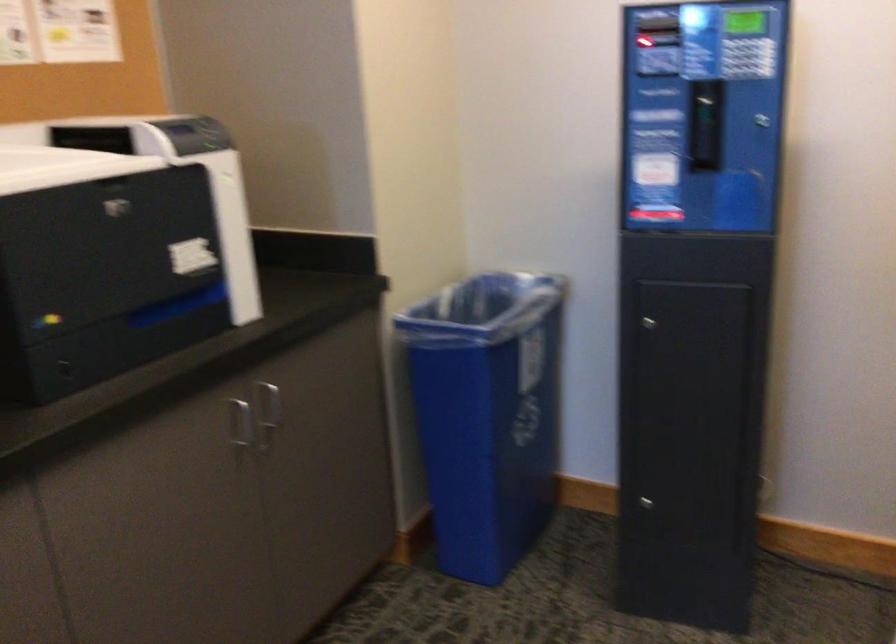
Image resolution: width=896 pixels, height=644 pixels. I want to click on machine door lock, so click(648, 504).